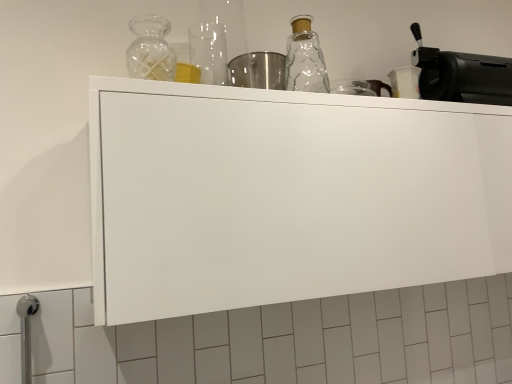
The height and width of the screenshot is (384, 512). What do you see at coordinates (461, 75) in the screenshot? I see `black matte coffee machine at upper right` at bounding box center [461, 75].

You are a GUI agent. You are given a task and a screenshot of the screen. Output one action in this format:
    pyautogui.click(x=<x>, y=<y>)
    Task: Click on the clear glass bottle at upper center
    The image size is (512, 384).
    Given the screenshot: What is the action you would take?
    pyautogui.click(x=151, y=49)

Who is smaller, black matte coffee machine at upper right or white matte cabinet at upper center?

Smaller between the two is black matte coffee machine at upper right.

Considering the relative sizes of black matte coffee machine at upper right and white matte cabinet at upper center in the image provided, is black matte coffee machine at upper right shorter than white matte cabinet at upper center?

Yes, black matte coffee machine at upper right is shorter than white matte cabinet at upper center.

From a real-world perspective, is black matte coffee machine at upper right positioned over white matte cabinet at upper center based on gravity?

Correct, in the physical world, black matte coffee machine at upper right is higher than white matte cabinet at upper center.

Is the depth of black matte coffee machine at upper right less than that of white matte cabinet at upper center?

No, it is behind white matte cabinet at upper center.

Does point (460, 76) appear closer or farther from the camera than point (138, 46)?

Point (460, 76) is positioned farther from the camera compared to point (138, 46).

Is black matte coffee machine at upper right looking in the opposite direction of clear glass bottle at upper center?

That's not correct — black matte coffee machine at upper right is not looking away from clear glass bottle at upper center.

From a real-world perspective, is black matte coffee machine at upper right on top of clear glass bottle at upper center?

Correct, in the physical world, black matte coffee machine at upper right is higher than clear glass bottle at upper center.

Who is shorter, black matte coffee machine at upper right or clear glass bottle at upper center?

With less height is clear glass bottle at upper center.

Is clear glass bottle at upper center aimed at black matte coffee machine at upper right?

No, clear glass bottle at upper center is not oriented towards black matte coffee machine at upper right.

Is clear glass bottle at upper center not inside black matte coffee machine at upper right?

Absolutely, clear glass bottle at upper center is external to black matte coffee machine at upper right.

Which is less distant, (153, 72) or (460, 69)?

Positioned in front is point (153, 72).

Where is `bottle below the black matte coffee machine at upper right (from the image's perspective)`? bottle below the black matte coffee machine at upper right (from the image's perspective) is located at coordinates (151, 49).

Is the position of clear glass bottle at upper center less distant than that of white matte cabinet at upper center?

No, clear glass bottle at upper center is behind white matte cabinet at upper center.

Between point (134, 41) and point (480, 271), which one is positioned behind?

The point (134, 41) is farther.

Locate an element on the screen. bottle lying behind the white matte cabinet at upper center is located at coordinates (151, 49).

From a real-world perspective, is white matte cabinet at upper center located higher than black matte coffee machine at upper right?

No, from a real-world perspective, white matte cabinet at upper center is not over black matte coffee machine at upper right

Is white matte cabinet at upper center taller or shorter than black matte coffee machine at upper right?

white matte cabinet at upper center is taller than black matte coffee machine at upper right.

Is white matte cabinet at upper center positioned in front of black matte coffee machine at upper right?

Yes, white matte cabinet at upper center is closer to the camera.

Looking at this image, which object is closer to the camera, white matte cabinet at upper center or clear glass bottle at upper center?

white matte cabinet at upper center is in front.

The image size is (512, 384). I want to click on bottle that appears behind the white matte cabinet at upper center, so click(x=151, y=49).

From the image's perspective, between white matte cabinet at upper center and clear glass bottle at upper center, which one is located above?

From the image's view, clear glass bottle at upper center is above.

From a real-world perspective, does white matte cabinet at upper center stand above clear glass bottle at upper center?

Actually, white matte cabinet at upper center is physically below clear glass bottle at upper center in the real world.

The height and width of the screenshot is (384, 512). I want to click on cabinetry directly beneath the black matte coffee machine at upper right (from a real-world perspective), so click(x=287, y=196).

Find the location of a particular element. This screenshot has width=512, height=384. bottle lying below the black matte coffee machine at upper right (from the image's perspective) is located at coordinates (151, 49).

Looking at the image, which one is located closer to clear glass bottle at upper center, white matte cabinet at upper center or black matte coffee machine at upper right?

white matte cabinet at upper center lies closer to clear glass bottle at upper center than the other object.

Looking at the image, which one is located further to black matte coffee machine at upper right, clear glass bottle at upper center or white matte cabinet at upper center?

Based on the image, clear glass bottle at upper center appears to be further to black matte coffee machine at upper right.

Consider the image. Estimate the real-world distances between objects in this image. Which object is further from white matte cabinet at upper center, black matte coffee machine at upper right or clear glass bottle at upper center?

Based on the image, black matte coffee machine at upper right appears to be further to white matte cabinet at upper center.

Considering their positions, is clear glass bottle at upper center positioned closer to white matte cabinet at upper center than black matte coffee machine at upper right?

clear glass bottle at upper center.

When comparing their distances from black matte coffee machine at upper right, does white matte cabinet at upper center or clear glass bottle at upper center seem further?

clear glass bottle at upper center.

Consider the image. Considering their positions, is black matte coffee machine at upper right positioned closer to clear glass bottle at upper center than white matte cabinet at upper center?

white matte cabinet at upper center.

The image size is (512, 384). Find the location of `cabinetry located between clear glass bottle at upper center and black matte coffee machine at upper right in the left-right direction`. cabinetry located between clear glass bottle at upper center and black matte coffee machine at upper right in the left-right direction is located at coordinates pyautogui.click(x=287, y=196).